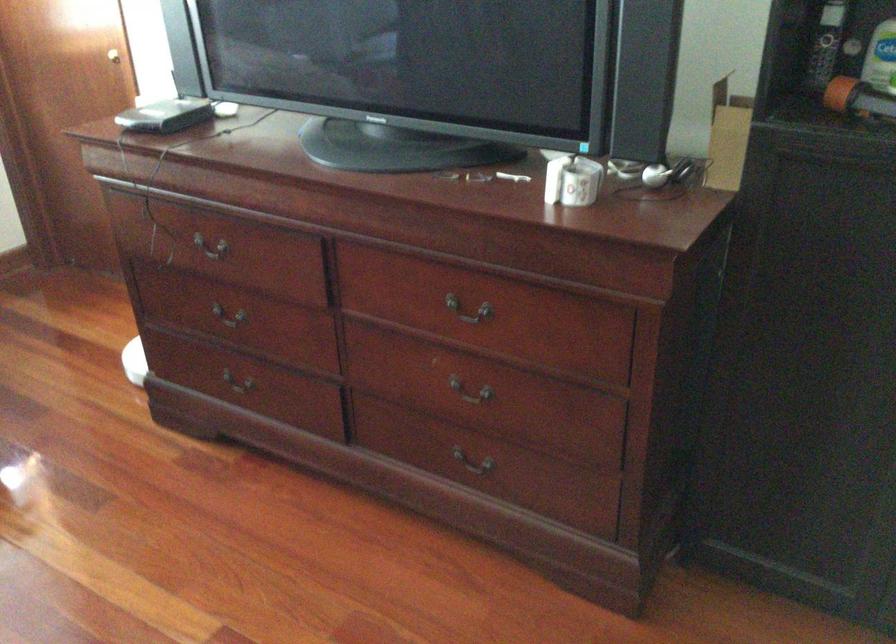
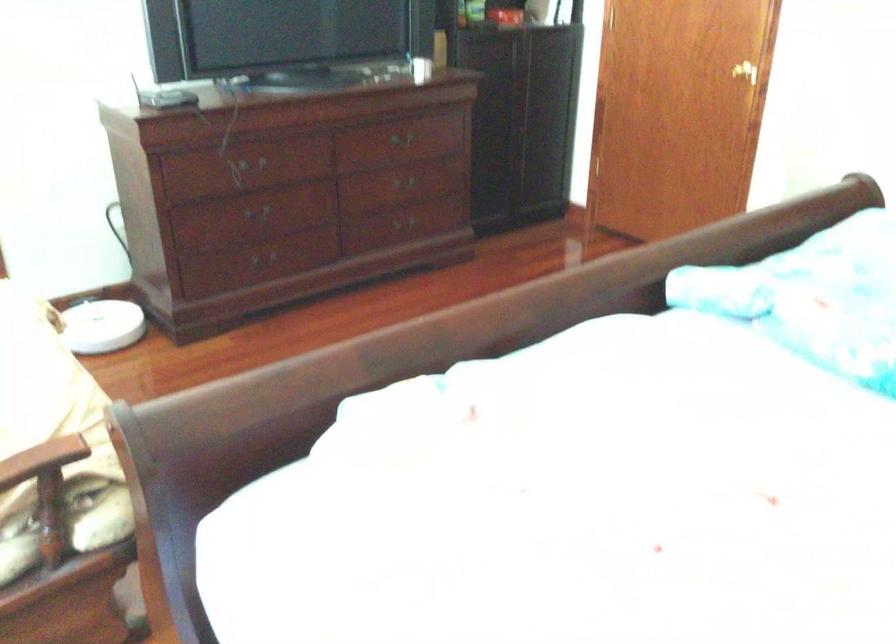
Locate, in the second image, the point that corresponds to point 141,368 in the first image.

(101, 326)